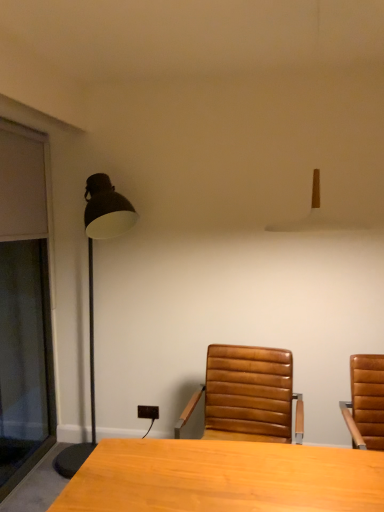
Question: From the image's perspective, is white matte lampshade at upper center, the 2th lamp in the back-to-front sequence, positioned above or below matte black floor lamp at left, which is counted as the 2th lamp, starting from the right?

Choices:
 (A) below
 (B) above

Answer: (B)

Question: Is white matte lampshade at upper center, the 2th lamp in the back-to-front sequence, in front of or behind matte black floor lamp at left, which is the 1th lamp in left-to-right order, in the image?

Choices:
 (A) front
 (B) behind

Answer: (A)

Question: Which object is positioned farthest from the transparent glass screen door at left?

Choices:
 (A) white matte lampshade at upper center, the 1th lamp viewed from the front
 (B) matte black floor lamp at left, arranged as the first lamp when viewed from the back
 (C) leather at center

Answer: (A)

Question: Which is farther from the matte black floor lamp at left, acting as the 2th lamp starting from the front?

Choices:
 (A) transparent glass screen door at left
 (B) white matte lampshade at upper center, the 2th lamp in the back-to-front sequence
 (C) leather at center

Answer: (C)